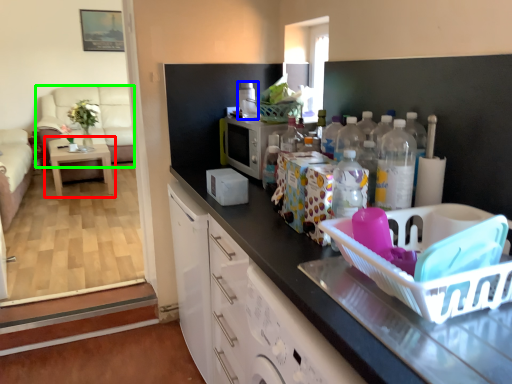
Question: Which is nearer to the table (highlighted by a red box)? appliance (highlighted by a blue box) or couch (highlighted by a green box).

Choices:
 (A) appliance
 (B) couch

Answer: (B)